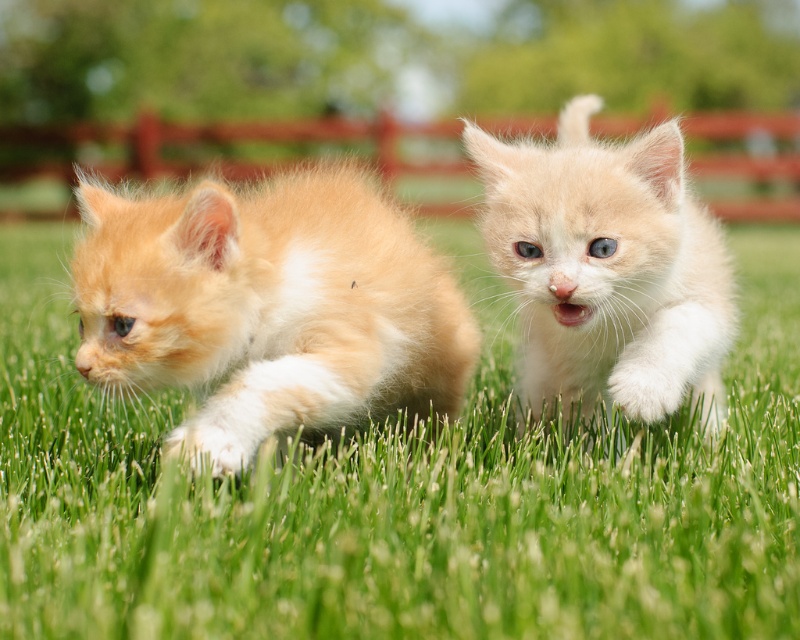
Question: Which object appears farthest from the camera in this image?

Choices:
 (A) green grassy at center
 (B) fluffy orange kitten at center
 (C) fluffy orange kitten at left

Answer: (B)

Question: Does green grassy at center appear over fluffy orange kitten at left?

Choices:
 (A) no
 (B) yes

Answer: (B)

Question: Based on their relative distances, which object is farther from the fluffy orange kitten at center?

Choices:
 (A) fluffy orange kitten at left
 (B) green grassy at center

Answer: (B)

Question: Where is fluffy orange kitten at left located in relation to fluffy orange kitten at center in the image?

Choices:
 (A) below
 (B) above

Answer: (A)

Question: Which point appears farthest from the camera in this image?

Choices:
 (A) (548, 340)
 (B) (622, 572)
 (C) (428, 380)

Answer: (C)

Question: From the image, what is the correct spatial relationship of fluffy orange kitten at left in relation to fluffy orange kitten at center?

Choices:
 (A) left
 (B) right

Answer: (A)